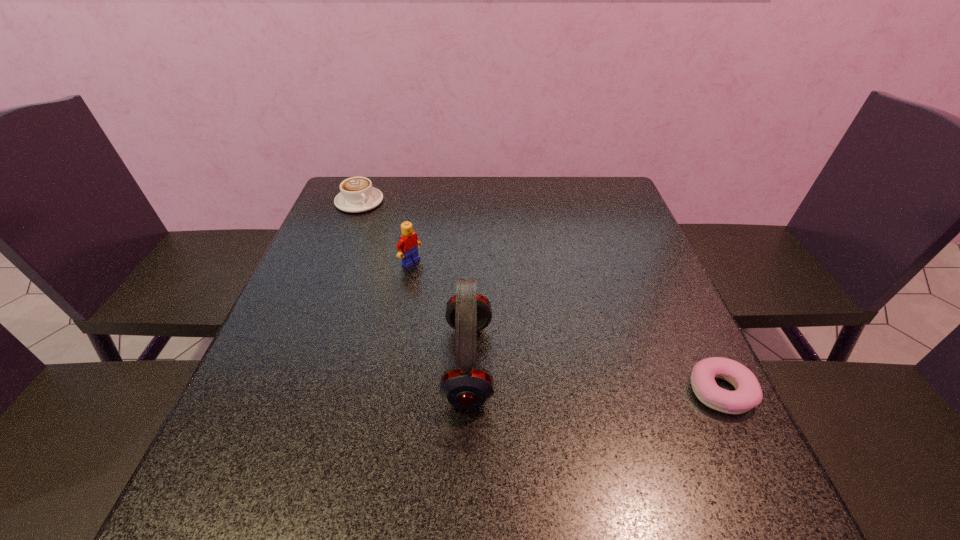
I want to click on free region located 0.110m on the ear cups of the tallest object, so click(389, 363).

Locate an element on the screen. The image size is (960, 540). vacant area situated 0.180m on the back of the rightmost object is located at coordinates (678, 303).

I want to click on vacant space located 0.130m with the handle on the right side of the cappuccino, so click(x=395, y=231).

This screenshot has width=960, height=540. I want to click on free space located with the handle on the right side of the cappuccino, so click(x=455, y=280).

Locate an element on the screen. The height and width of the screenshot is (540, 960). free space located with the handle on the right side of the cappuccino is located at coordinates (428, 258).

You are a GUI agent. You are given a task and a screenshot of the screen. Output one action in this format:
    pyautogui.click(x=<x>, y=<y>)
    Task: Click on the free space located on the face of the second farthest object
    
    Given the screenshot: What is the action you would take?
    pyautogui.click(x=461, y=292)

The image size is (960, 540). I want to click on vacant space located 0.360m on the face of the second farthest object, so click(x=539, y=338).

I want to click on free location located 0.230m on the face of the second farthest object, so click(491, 309).

What are the coordinates of `object at the far edge` in the screenshot? It's located at (357, 195).

Image resolution: width=960 pixels, height=540 pixels. I want to click on earphone present at the near edge, so click(466, 385).